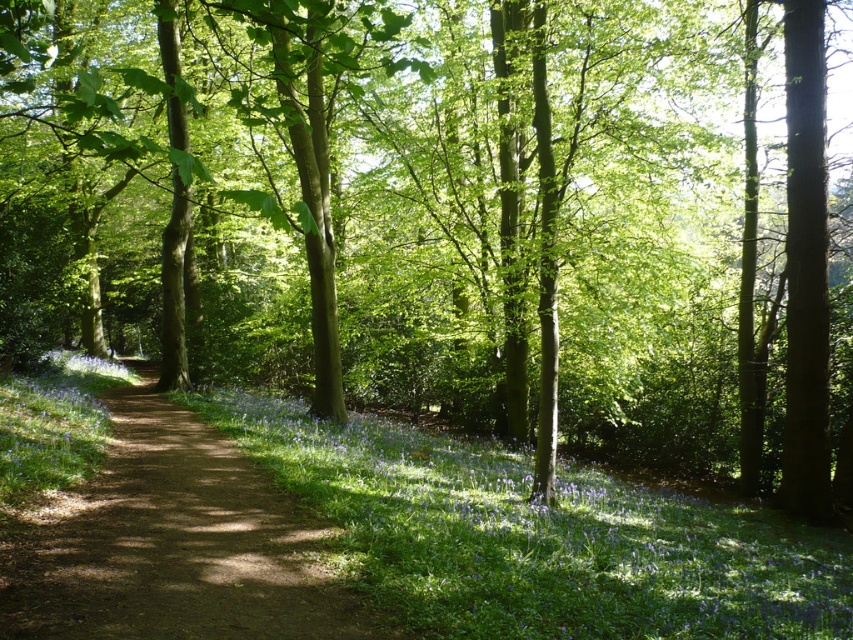
Question: Which of the following is the closest to the observer?

Choices:
 (A) (622, 480)
 (B) (33, 547)

Answer: (B)

Question: Which point appears farthest from the camera in this image?

Choices:
 (A) (811, 598)
 (B) (282, 572)

Answer: (A)

Question: Where is blue matte flowers at center located in relation to dirt path at center in the image?

Choices:
 (A) below
 (B) above

Answer: (A)

Question: Can you confirm if blue matte flowers at center is wider than dirt path at center?

Choices:
 (A) yes
 (B) no

Answer: (A)

Question: Can you confirm if blue matte flowers at center is positioned to the right of dirt path at center?

Choices:
 (A) no
 (B) yes

Answer: (B)